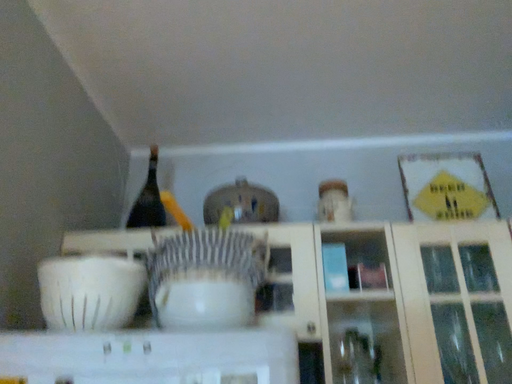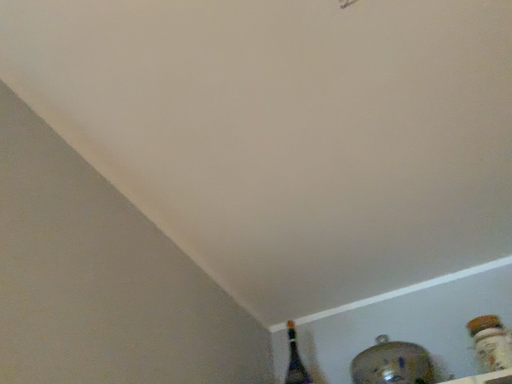
Question: Which way did the camera rotate in the video?

Choices:
 (A) rotated downward
 (B) rotated upward

Answer: (B)